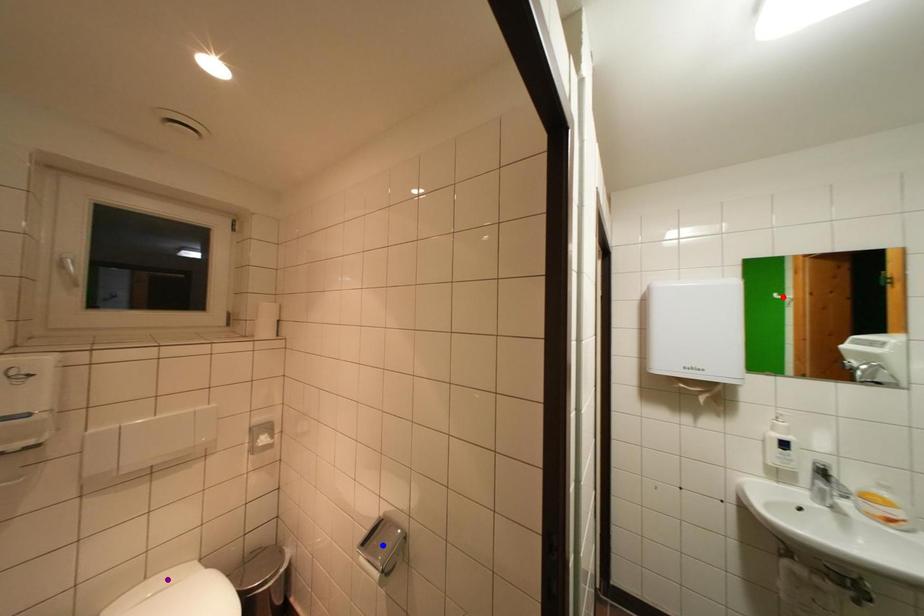
Order these from farthest to nearest:
purple point | red point | blue point

red point
blue point
purple point